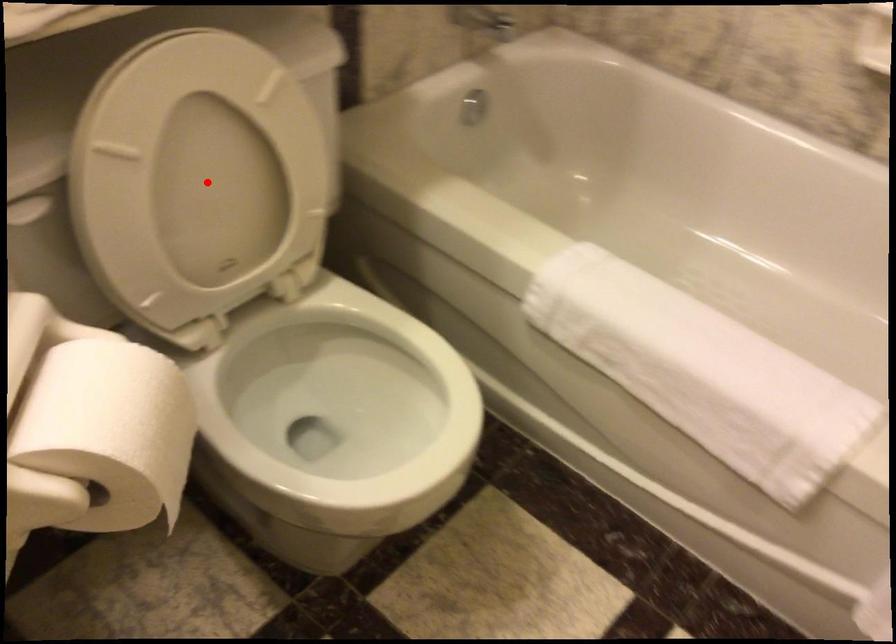
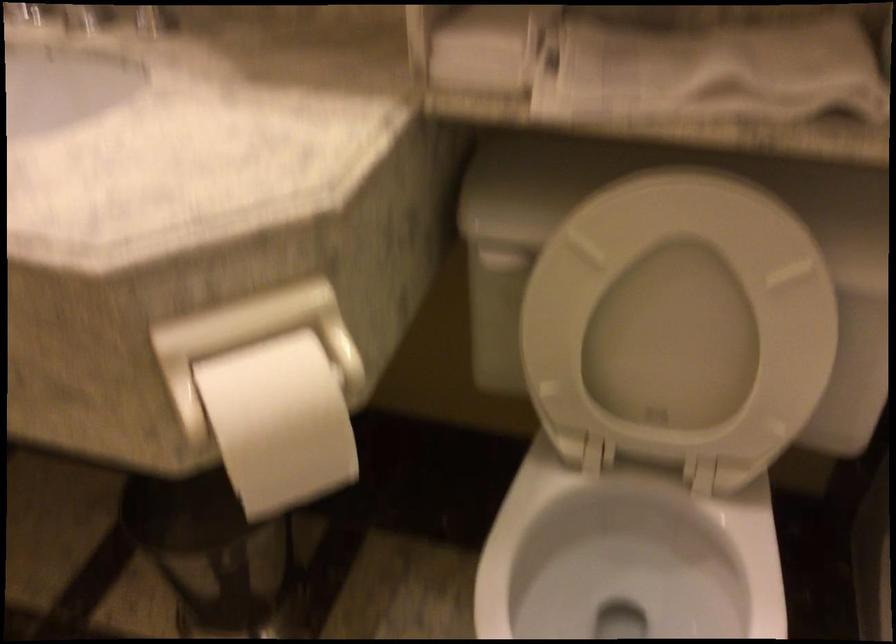
Where in the second image is the point corresponding to the highlighted location from the first image?

(678, 322)